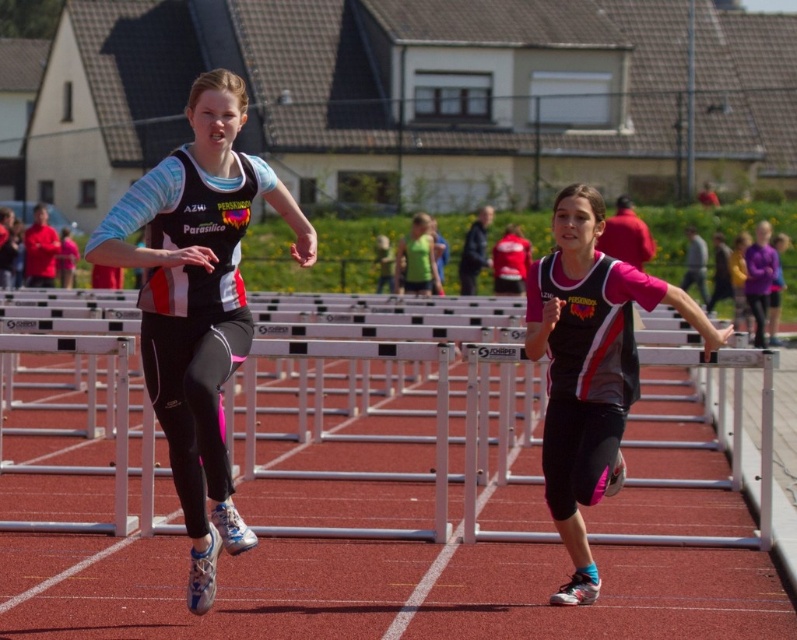
You are a coach analyzing a hurdle race video. You notice the matte black vest at left and the metallic silver hurdle at center. Which object has a smaller width when viewed from the coach perspective?

The matte black vest at left has a smaller width than the metallic silver hurdle at center.

Based on the scene description, can you determine which object, the matte black vest at left or the metallic silver hurdle at center, is taller?

The matte black vest at left is taller than the metallic silver hurdle at center according to the description.